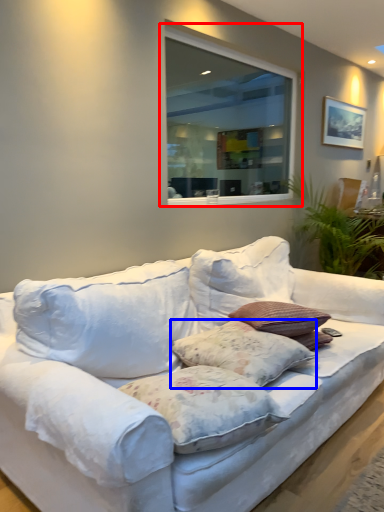
Question: Which object appears closest to the camera in this image, window (highlighted by a red box) or pillow (highlighted by a blue box)?

Choices:
 (A) window
 (B) pillow

Answer: (B)